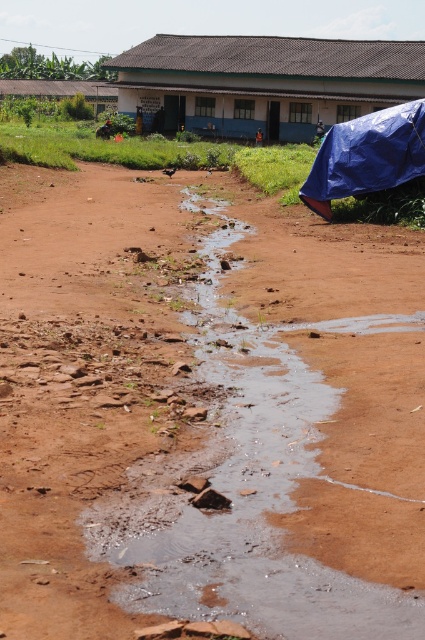
Consider the image. Does blue corrugated metal hut at upper center have a lesser height compared to brown corrugated metal hut at upper center?

No, blue corrugated metal hut at upper center is not shorter than brown corrugated metal hut at upper center.

Does blue corrugated metal hut at upper center have a greater width compared to brown corrugated metal hut at upper center?

Yes, blue corrugated metal hut at upper center is wider than brown corrugated metal hut at upper center.

This screenshot has width=425, height=640. What do you see at coordinates (265, 83) in the screenshot?
I see `blue corrugated metal hut at upper center` at bounding box center [265, 83].

Where is `blue corrugated metal hut at upper center`? blue corrugated metal hut at upper center is located at coordinates (265, 83).